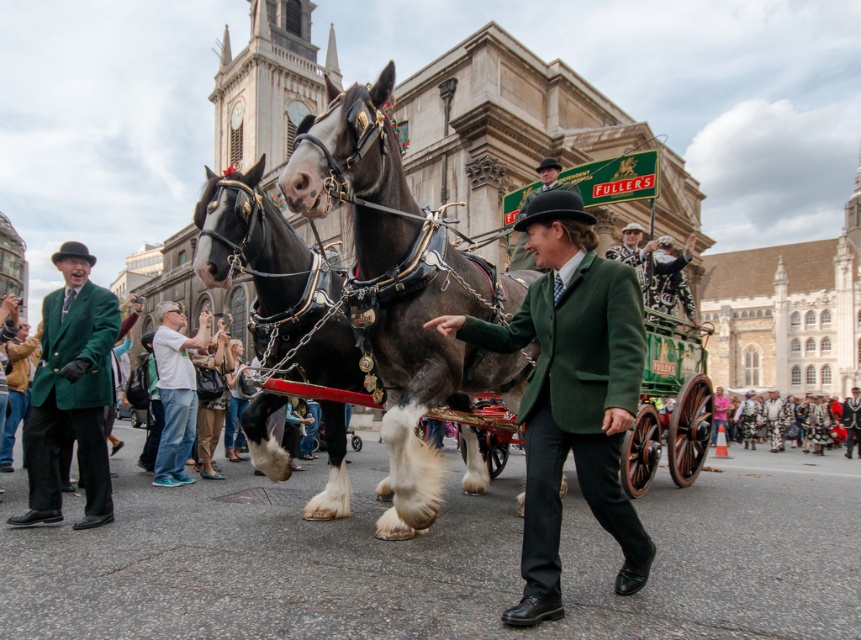
You are a photographer trying to capture a photo of the shiny dark brown horse at center and the patterned fabric hat at upper center. Which object should be placed on the left side of the photo frame to include both in the shot?

The shiny dark brown horse at center should be placed on the left side of the photo frame because it is positioned on the left side of the patterned fabric hat at upper center, ensuring both are included in the shot.

You are a photographer standing in the crowd at the parade. You want to take a photo of both the green velvet jacket at center and the green woolen coat at center. Which one should you focus on first if you want to capture them from left to right in the order they appear?

The green velvet jacket at center should be focused on first since it is positioned on the left side of the green woolen coat at center, making it the leftmost item in the frame.

You are a photographer trying to capture a photo of the shiny dark brown horse at center and the patterned fabric hat at upper center. Since you want both subjects to appear proportionally sized in the photo, which subject should you move closer to?

The shiny dark brown horse at center is larger in size than the patterned fabric hat at upper center. To make both subjects appear proportionally sized in the photo, you should move closer to the patterned fabric hat at upper center to enlarge its image while moving away from the shiny dark brown horse at center to reduce its size in the frame.